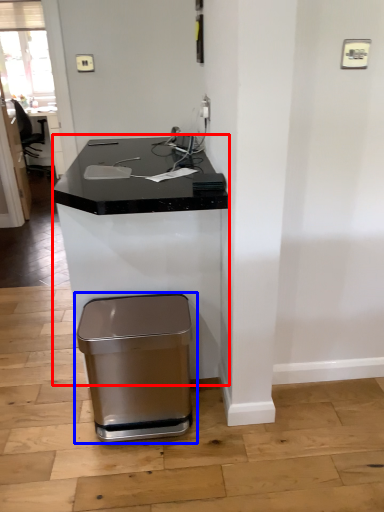
Question: Among these objects, which one is nearest to the camera, computer desk (highlighted by a red box) or waste container (highlighted by a blue box)?

Choices:
 (A) computer desk
 (B) waste container

Answer: (A)